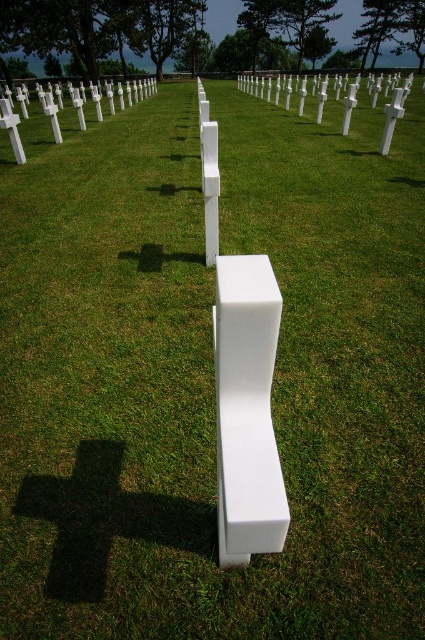
Question: Can you confirm if white matte cross at center is bigger than white matte cross at upper left?

Choices:
 (A) yes
 (B) no

Answer: (A)

Question: Does white matte cross at center appear over white matte cross at upper left?

Choices:
 (A) yes
 (B) no

Answer: (A)

Question: Which of the following is the closest to the observer?

Choices:
 (A) (71, 96)
 (B) (391, 113)

Answer: (B)

Question: Which point is farther to the camera?

Choices:
 (A) (82, 125)
 (B) (289, 83)

Answer: (B)

Question: Observing the image, what is the correct spatial positioning of white matte cross at center in reference to white matte cross at upper left?

Choices:
 (A) below
 (B) above

Answer: (B)